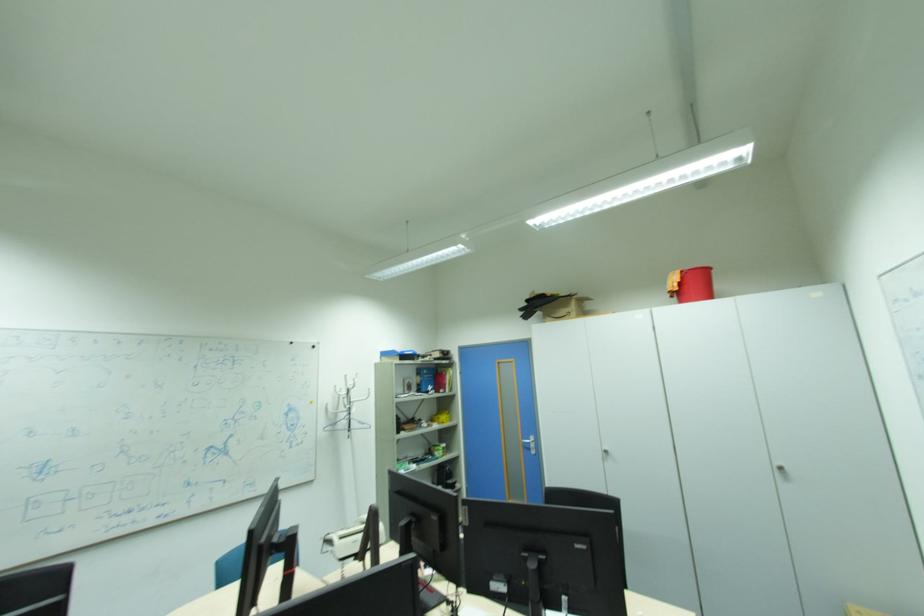
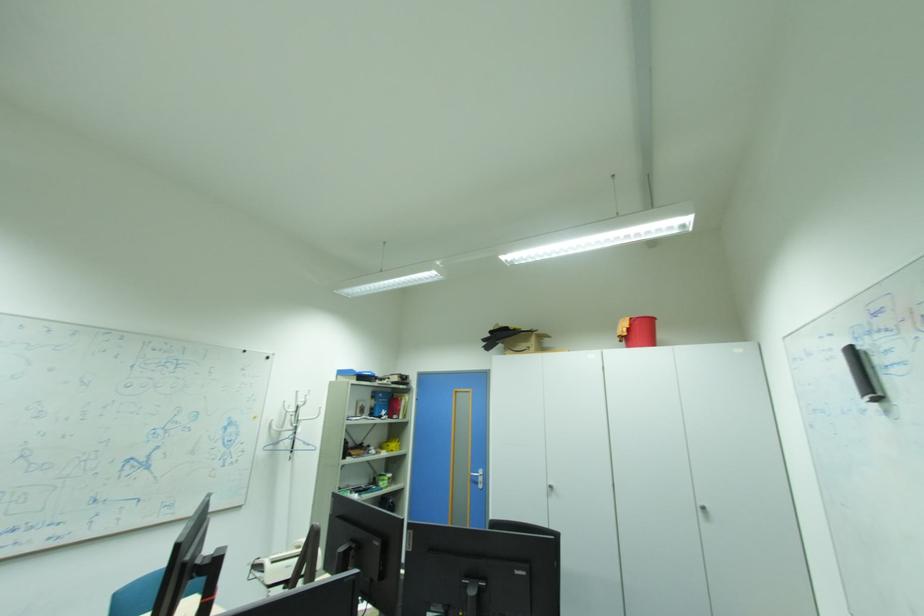
Question: The images are taken continuously from a first-person perspective. In which direction is your viewpoint rotating?

Choices:
 (A) Left
 (B) Right
 (C) Up
 (D) Down

Answer: (B)